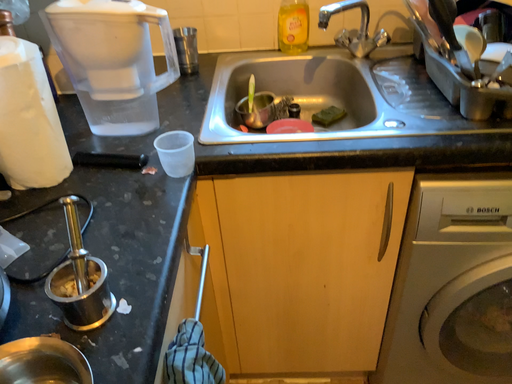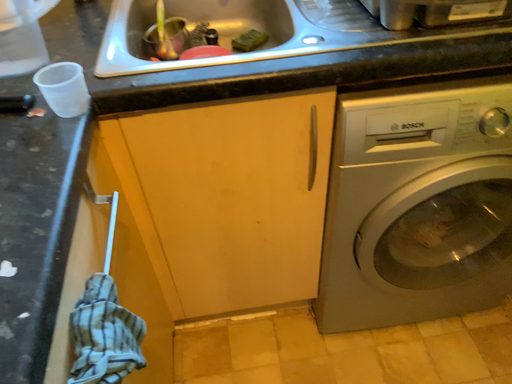
Question: How did the camera likely rotate when shooting the video?

Choices:
 (A) rotated right
 (B) rotated left

Answer: (A)